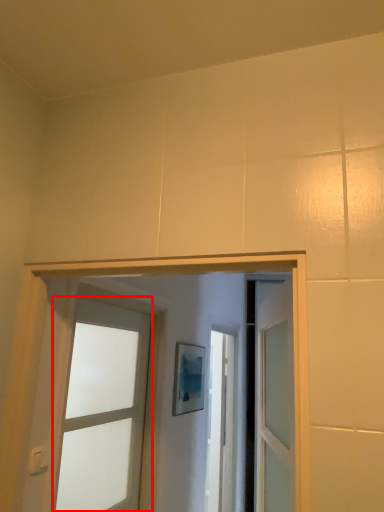
Question: Observing the image, what is the correct spatial positioning of door (annotated by the red box) in reference to light switch?

Choices:
 (A) right
 (B) left

Answer: (A)